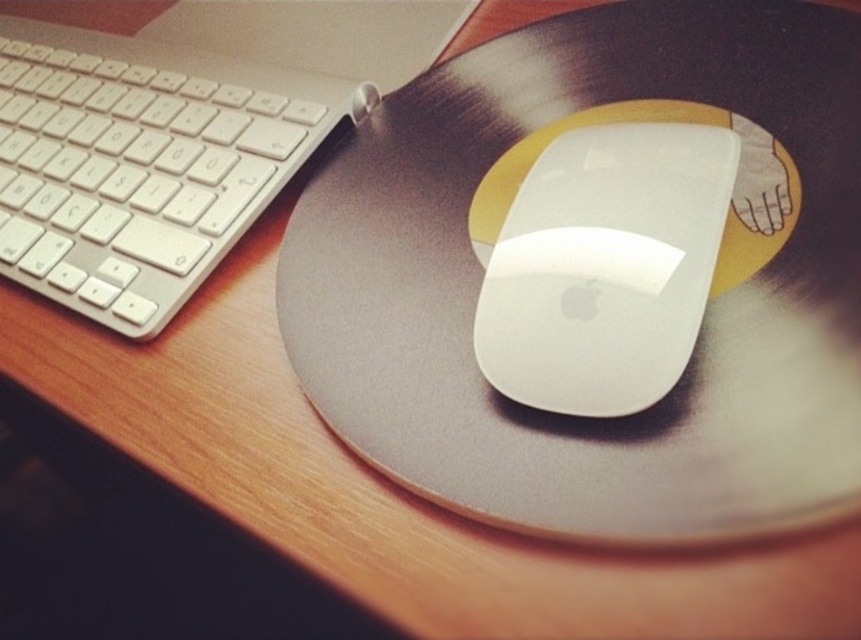
Can you confirm if white plastic keyboard at left is bigger than white glossy mouse at center?

Indeed, white plastic keyboard at left has a larger size compared to white glossy mouse at center.

From the picture: Can you confirm if white plastic keyboard at left is thinner than white glossy mouse at center?

No, white plastic keyboard at left is not thinner than white glossy mouse at center.

Which is behind, point (34, 28) or point (530, 332)?

Positioned behind is point (34, 28).

Locate an element on the screen. Image resolution: width=861 pixels, height=640 pixels. white plastic keyboard at left is located at coordinates (178, 134).